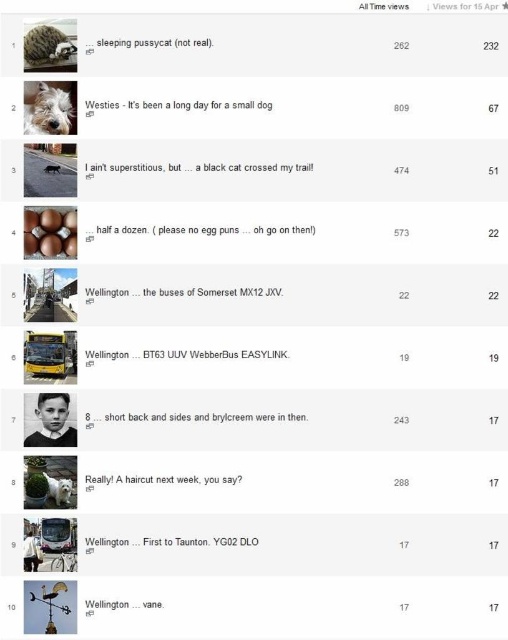
Between point (42, 125) and point (36, 42), which one is positioned behind?

Point (42, 125)

Between point (47, 84) and point (50, 33), which one is positioned behind?

Point (47, 84)

Where is `fluffy white dog at upper left`? This screenshot has width=508, height=640. fluffy white dog at upper left is located at coordinates (48, 109).

Is fluffy brown hedgehog at upper left further to the viewer compared to white fluffy dog at lower left?

No.

Between point (27, 35) and point (64, 499), which one is positioned in front?

Positioned in front is point (27, 35).

Is point (59, 42) less distant than point (64, 502)?

That is True.

The image size is (508, 640). In order to click on fluffy brown hedgehog at upper left in this screenshot , I will do `click(47, 48)`.

Which is more to the right, fluffy white dog at upper left or white fluffy dog at lower left?

white fluffy dog at lower left

Is fluffy white dog at upper left bigger than white fluffy dog at lower left?

Correct, fluffy white dog at upper left is larger in size than white fluffy dog at lower left.

Is point (26, 113) positioned before point (56, 493)?

Yes, point (26, 113) is closer to viewer.

Identify the location of fluffy white dog at upper left. (48, 109).